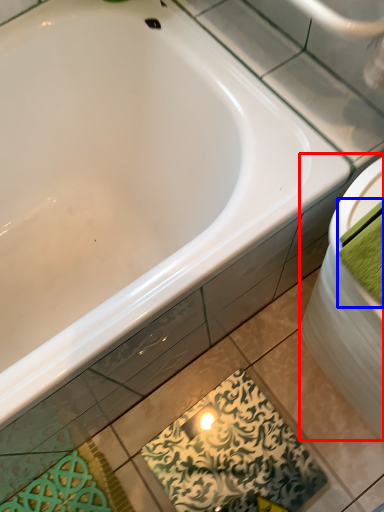
Question: Which of the following is the closest to the observer, sink (highlighted by a red box) or bath towel (highlighted by a blue box)?

Choices:
 (A) sink
 (B) bath towel

Answer: (B)